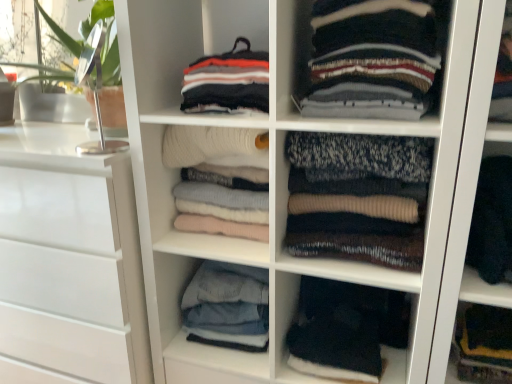
Question: From a real-world perspective, is soft white sweater at center, which appears as the fifth clothing when viewed from the right, above or below knit sweater at center, the 3th clothing in the right-to-left sequence?

Choices:
 (A) above
 (B) below

Answer: (B)

Question: In the image, is soft white sweater at center, which is counted as the second clothing, starting from the left, positioned in front of or behind knit sweater at center, the 3th clothing in the right-to-left sequence?

Choices:
 (A) behind
 (B) front

Answer: (A)

Question: Which object is the farthest from the white glossy chest of drawers at left?

Choices:
 (A) soft white sweater at center, which appears as the fifth clothing when viewed from the right
 (B) knit sweater at center, the 3th clothing in the right-to-left sequence
 (C) black knitwear at lower center
 (D) denim jeans at center, positioned as the 6th clothing in right-to-left order
 (E) striped wool sweater at center, the 5th clothing viewed from the left

Answer: (E)

Question: Which is farther from the striped wool sweater at center, which appears as the 2th clothing when viewed from the right?

Choices:
 (A) knit sweater at center, the 3th clothing in the right-to-left sequence
 (B) denim jeans at center, arranged as the 1th clothing when viewed from the left
 (C) striped cotton sweater at upper center, placed as the 4th clothing when sorted from right to left
 (D) dark wool sweater at right, placed as the 1th clothing when sorted from right to left
 (E) soft white sweater at center, which appears as the fifth clothing when viewed from the right

Answer: (B)